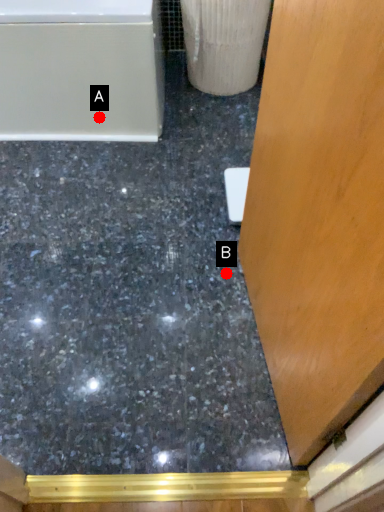
Question: Two points are circled on the image, labeled by A and B beside each circle. Among these points, which one is nearest to the camera?

Choices:
 (A) A is closer
 (B) B is closer

Answer: (B)